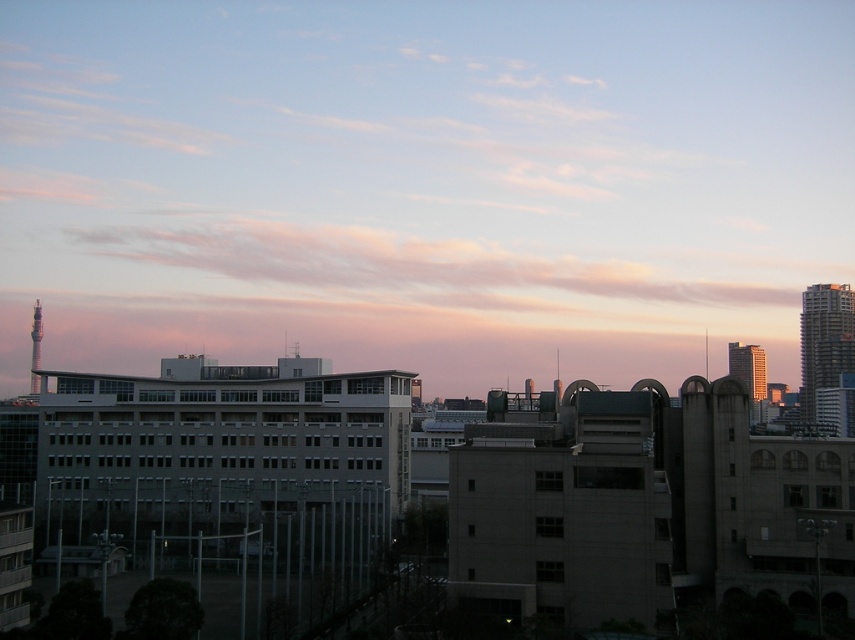
Question: Is matte gray building at center to the right of silver metallic skyscraper at right from the viewer's perspective?

Choices:
 (A) yes
 (B) no

Answer: (B)

Question: Which of the following is the closest to the observer?

Choices:
 (A) (832, 188)
 (B) (823, 312)

Answer: (B)

Question: Among these objects, which one is nearest to the camera?

Choices:
 (A) silver metallic skyscraper at right
 (B) matte gray building at center

Answer: (A)

Question: In this image, where is matte gray building at center located relative to silver metallic skyscraper at right?

Choices:
 (A) above
 (B) below

Answer: (A)

Question: Is matte gray building at center to the left of silver metallic skyscraper at right from the viewer's perspective?

Choices:
 (A) yes
 (B) no

Answer: (A)